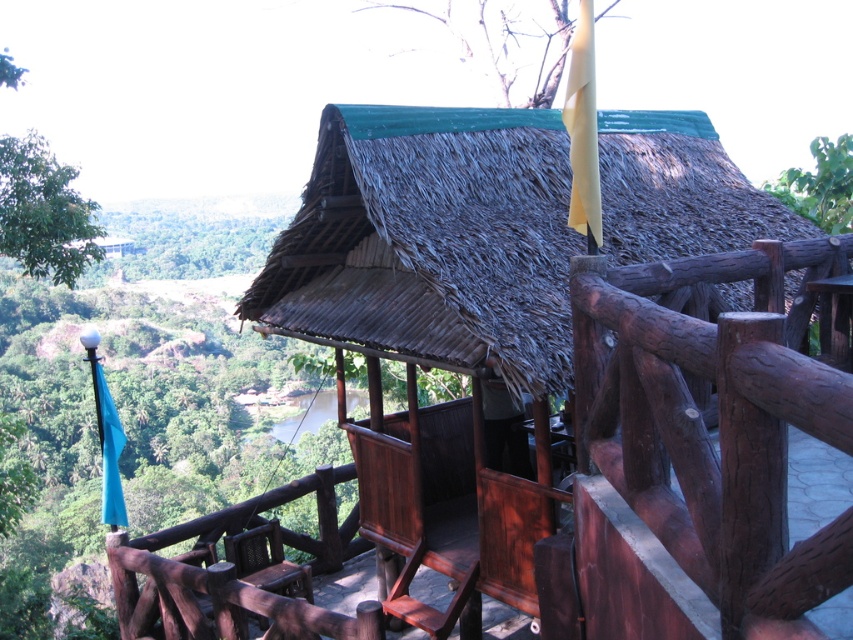
Question: Which point appears closest to the camera in this image?

Choices:
 (A) (61, 216)
 (B) (345, 148)
 (C) (732, 417)

Answer: (C)

Question: Can you confirm if brown wood/rustic rail at center-right is bigger than green thatch roof at upper center?

Choices:
 (A) yes
 (B) no

Answer: (B)

Question: Which point is farther to the camera?

Choices:
 (A) pos(90,257)
 (B) pos(833,198)

Answer: (B)

Question: Which point appears farthest from the camera in this image?

Choices:
 (A) (10, 234)
 (B) (805, 371)
 (C) (850, 218)
 (D) (531, 49)

Answer: (D)

Question: Is green leafy tree at upper left to the right of green thatch roof at upper center from the viewer's perspective?

Choices:
 (A) yes
 (B) no

Answer: (B)

Question: Is green thatch roof at center below green leafy tree at upper left?

Choices:
 (A) no
 (B) yes

Answer: (B)